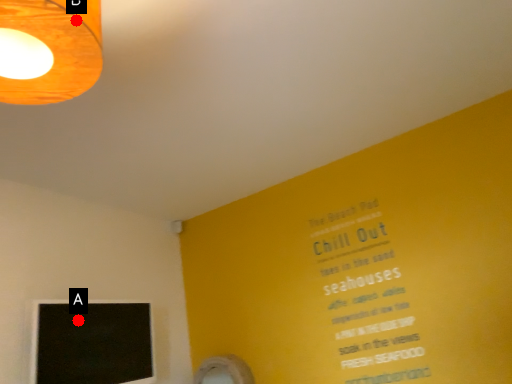
Question: Two points are circled on the image, labeled by A and B beside each circle. Which point appears closest to the camera in this image?

Choices:
 (A) A is closer
 (B) B is closer

Answer: (B)